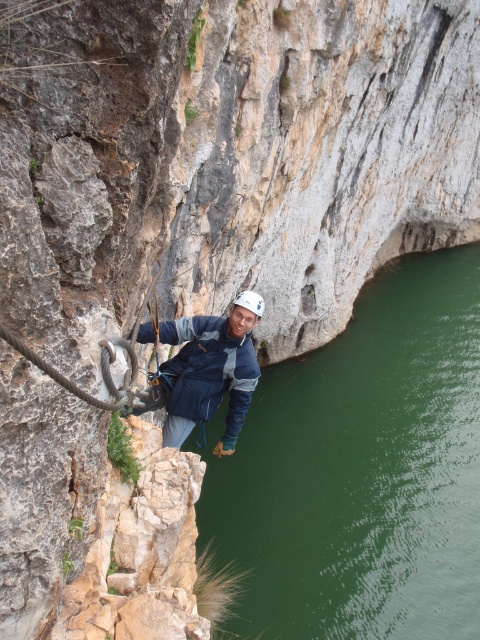
Which is in front, point (279, 573) or point (240, 291)?

Point (279, 573)

Does point (459, 428) come farther from viewer compared to point (255, 307)?

Yes, it is.

What are the coordinates of `green liquid water at center` in the screenshot? It's located at (362, 468).

Looking at this image, is green liquid water at center behind black rubber rope at center?

Yes, green liquid water at center is behind black rubber rope at center.

Measure the distance between green liquid water at center and camera.

green liquid water at center is 21.31 meters from camera.

Is point (304, 568) positioned before point (26, 353)?

No, it is not.

This screenshot has width=480, height=640. I want to click on green liquid water at center, so click(x=362, y=468).

Does blue fabric jacket at center have a larger size compared to black rubber rope at center?

Indeed, blue fabric jacket at center has a larger size compared to black rubber rope at center.

This screenshot has height=640, width=480. What are the coordinates of `blue fabric jacket at center` in the screenshot? It's located at (208, 369).

Is point (210, 397) behind point (0, 332)?

Yes, it is.

The image size is (480, 640). Find the location of `blue fabric jacket at center`. blue fabric jacket at center is located at coordinates (208, 369).